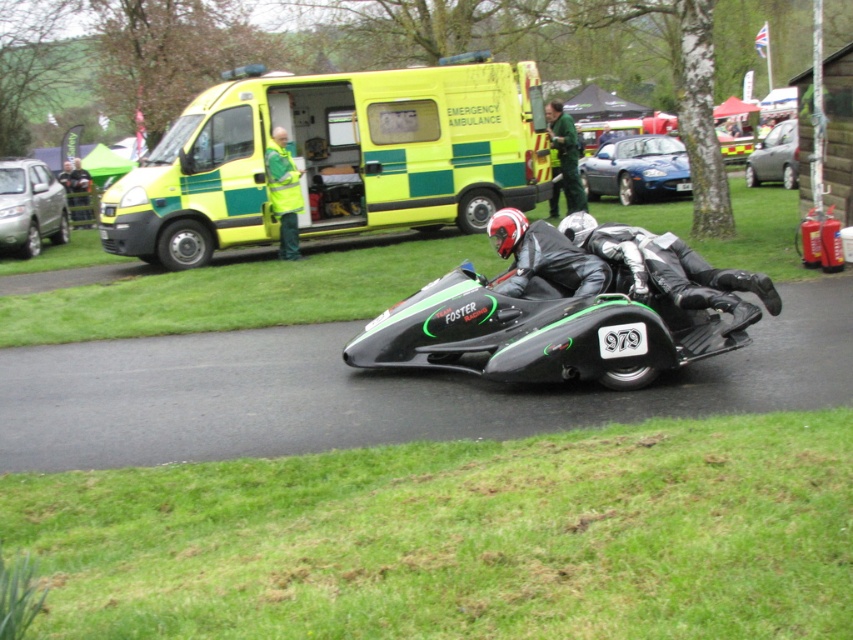
Question: Can you confirm if black matte sidecar at center is positioned above silver metallic car at left?

Choices:
 (A) no
 (B) yes

Answer: (A)

Question: Does silver metallic car at left appear on the right side of metallic silver car at right?

Choices:
 (A) no
 (B) yes

Answer: (A)

Question: Is black matte sidecar at center to the right of silver metallic car at left from the viewer's perspective?

Choices:
 (A) yes
 (B) no

Answer: (A)

Question: Which object is positioned closest to the shiny blue car at center?

Choices:
 (A) green reflective jacket at center
 (B) black leather suit at center

Answer: (A)

Question: Which point is farther from the camera taking this photo?

Choices:
 (A) (320, 132)
 (B) (296, 198)

Answer: (A)

Question: Which point is closer to the camera taking this photo?

Choices:
 (A) (584, 236)
 (B) (611, 193)
 (C) (267, 157)

Answer: (A)